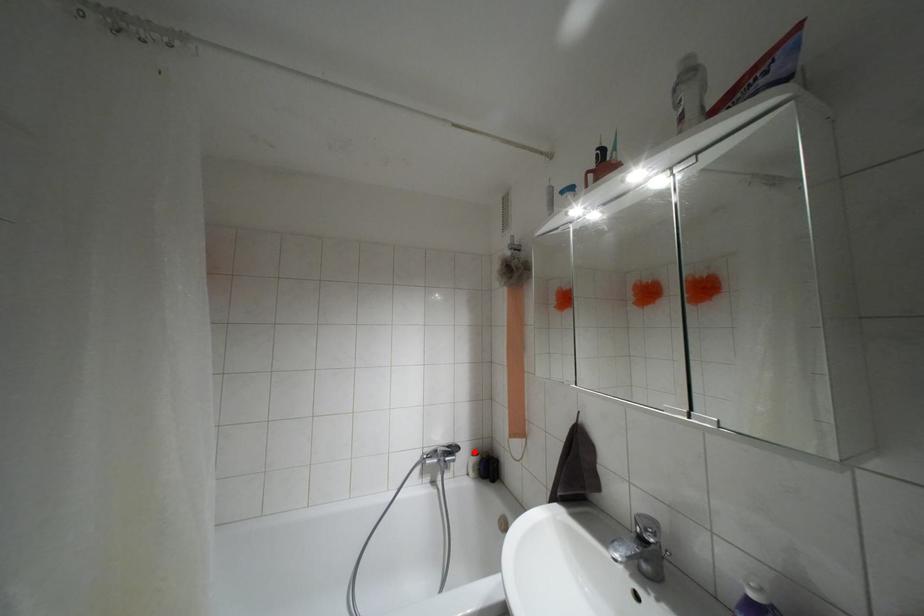
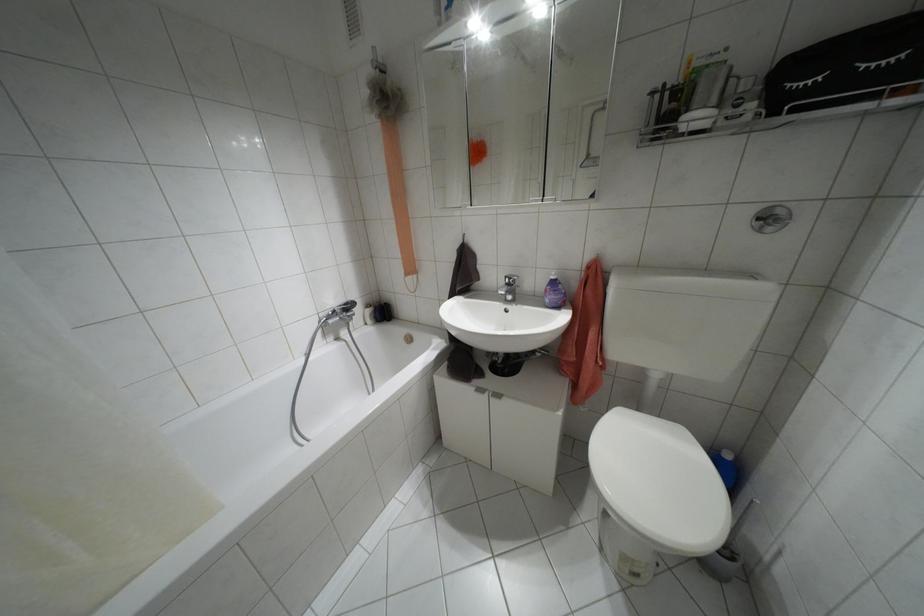
In the second image, find the point that corresponds to the highlighted location in the first image.

(367, 305)